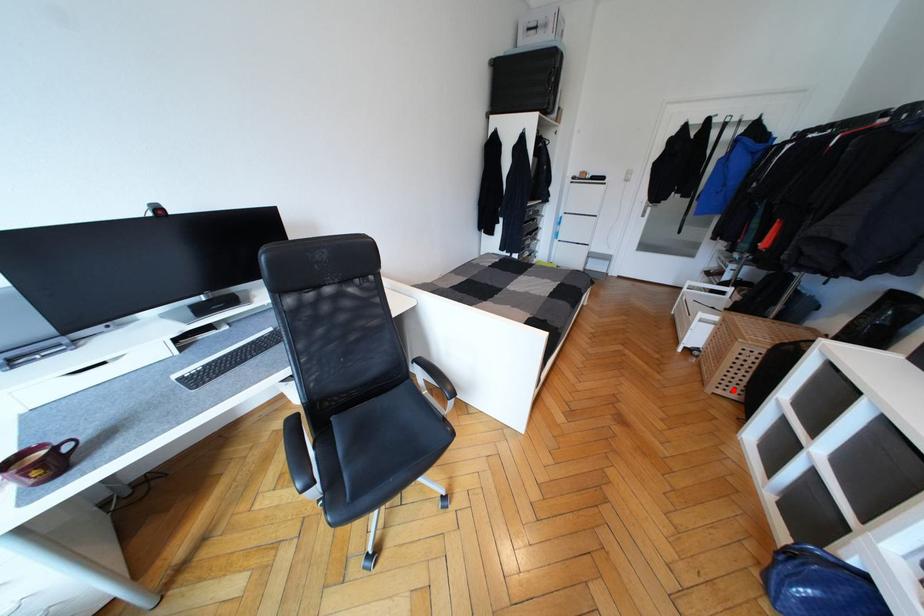
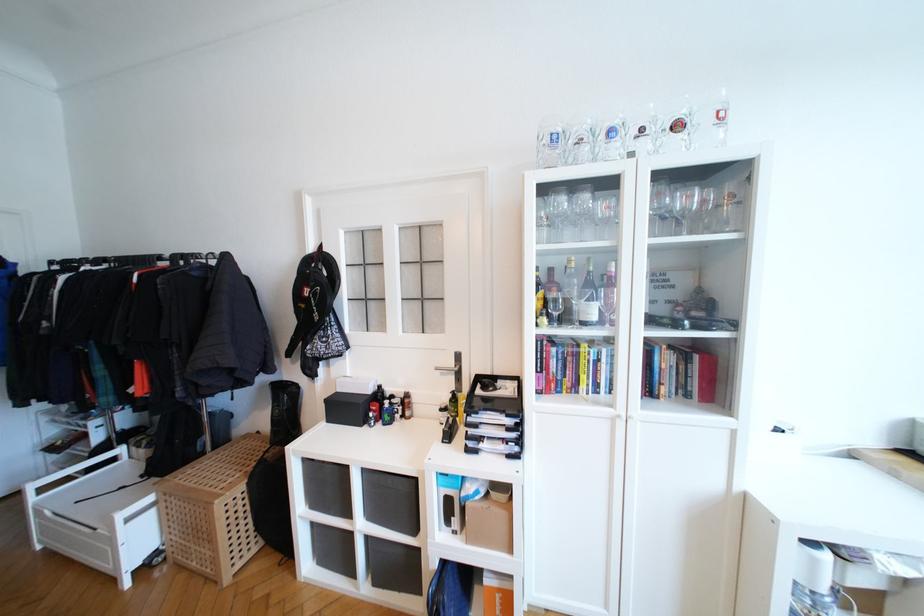
Question: I am providing you with two images of the same scene from different viewpoints. A red point is shown in image1. For the corresponding object point in image2, is it positioned nearer or farther from the camera?

Choices:
 (A) Nearer
 (B) Farther

Answer: (B)